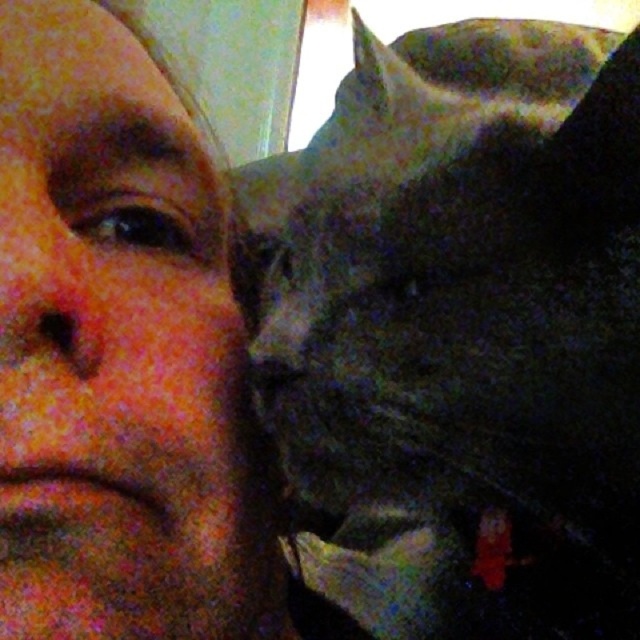
You are a photographer trying to focus on the matte skin at center and the dark gray fur at right in the image. Which object is closer to the camera?

The dark gray fur at right is closer to the camera than the matte skin at center since the matte skin at center is behind the dark gray fur at right.

Based on the scene description, where is the dark gray fur at right positioned in relation to the human face on the left?

The dark gray fur at right is located at point (x=458, y=332), which is to the right of the human face on the left side of the frame.

Based on the scene description, can you determine if the dark gray fur at right is positioned higher than the matte skin at center?

Yes, the dark gray fur at right is above the matte skin at center according to the description.